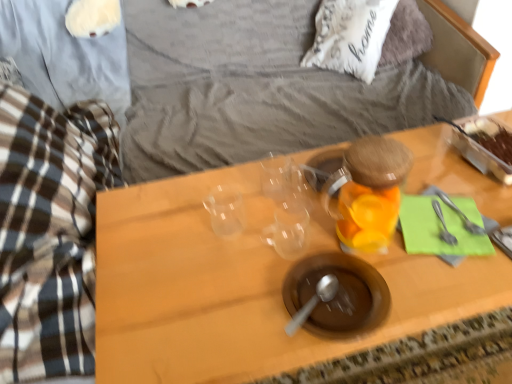
You are a GUI agent. You are given a task and a screenshot of the screen. Output one action in this format:
    pyautogui.click(x=<x>, y=<y>)
    Task: Click on the free spot behind silver metallic fork at right, the second silverware positioned from the left
    
    Given the screenshot: What is the action you would take?
    [x=447, y=176]